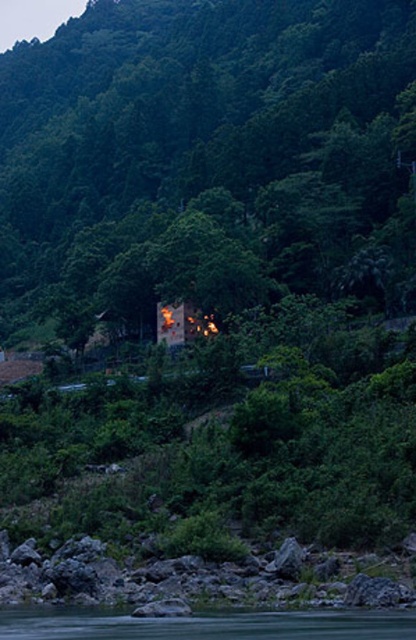
You are standing at the edge of the water in the scene. Which object, the green leafy tree at center or the green smooth water at lower center, has a greater width from your perspective?

The green leafy tree at center might be wider than the green smooth water at lower center according to the description.

You are standing on the rocky shoreline and want to walk to the green smooth water at lower center. Which direction should you head relative to the green leafy tree at center?

You should head to the right of the green leafy tree at center because the green smooth water at lower center is located to the right of the tree.

Looking at this image, you are a hiker who wants to cross the green smooth water at lower center to reach the green leafy tree at center. Given that your backpack has a 100 meter rope, can you safely use it to cross the distance?

The green leafy tree at center and green smooth water at lower center are 126.93 meters apart. Since the rope is only 100 meters long, it is not long enough to safely cross the distance between the green smooth water at lower center and the green leafy tree at center.